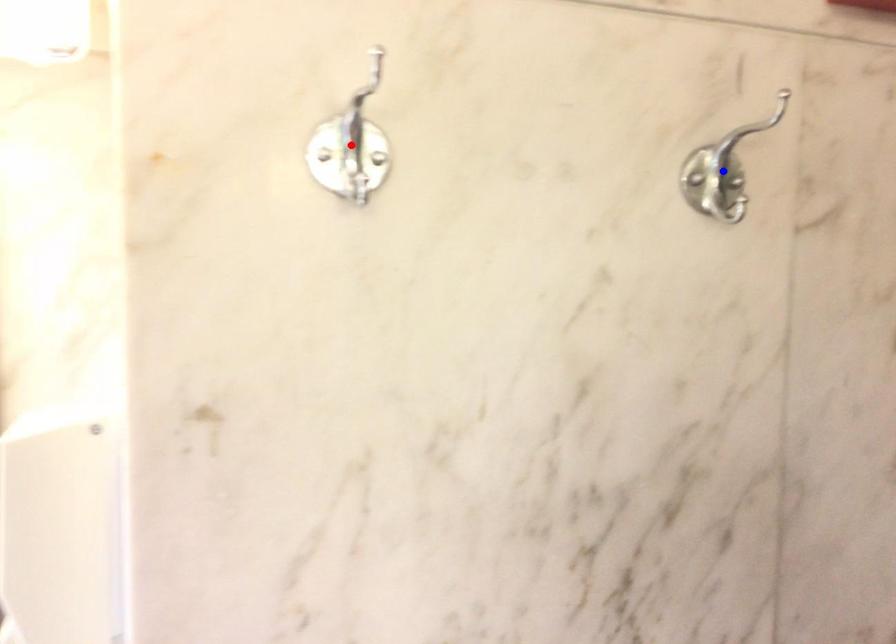
Question: In the image, two points are highlighted. Which point is nearer to the camera? Reply with the corresponding letter.

Choices:
 (A) blue point
 (B) red point

Answer: (B)